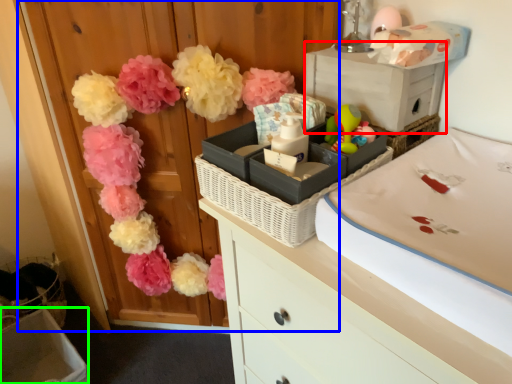
Question: Which is nearer to the storage box (highlighted by a red box)? armoire (highlighted by a blue box) or storage box (highlighted by a green box).

Choices:
 (A) armoire
 (B) storage box

Answer: (A)